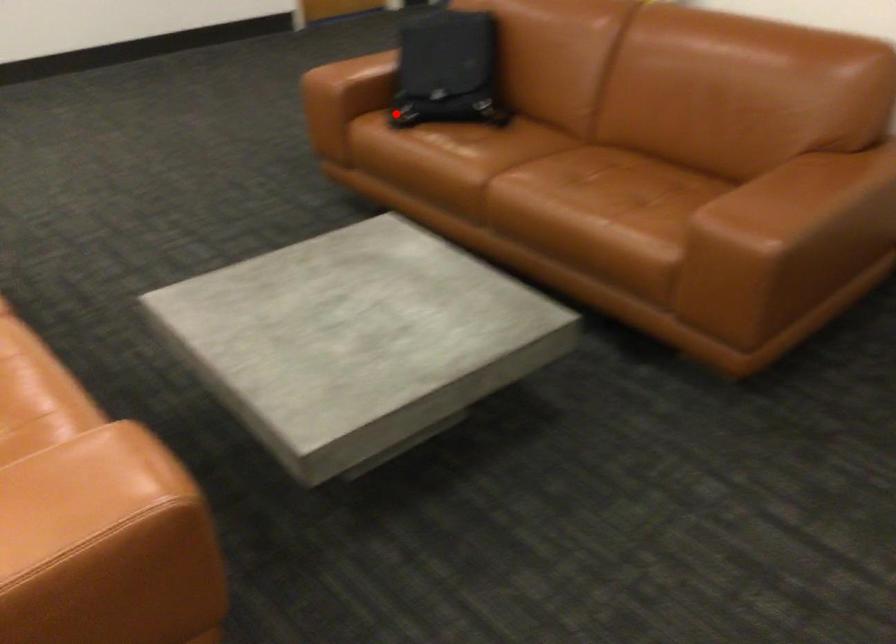
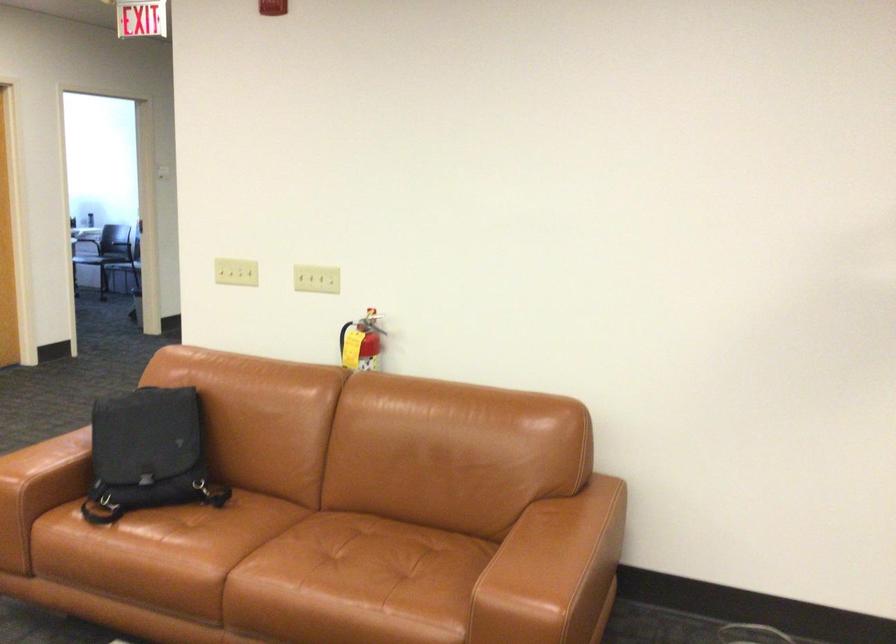
Locate, in the second image, the point that corresponds to the highlighted location in the first image.

(92, 514)